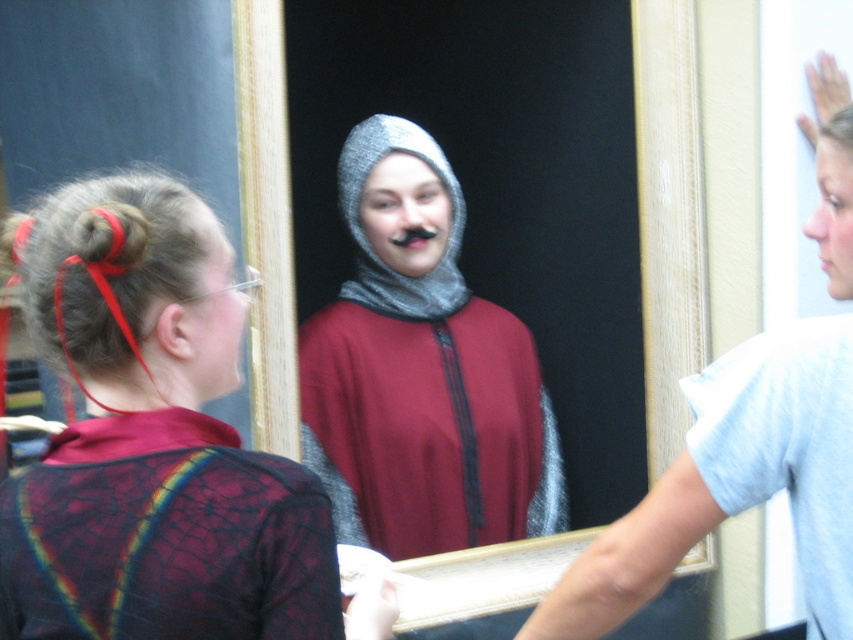
In the scene shown: Can you confirm if crinkled fabric robe at center is positioned below light blue cotton t-shirt at right?

Yes, crinkled fabric robe at center is below light blue cotton t-shirt at right.

Is crinkled fabric robe at center above light blue cotton t-shirt at right?

No, crinkled fabric robe at center is not above light blue cotton t-shirt at right.

The image size is (853, 640). Find the location of `crinkled fabric robe at center`. crinkled fabric robe at center is located at coordinates (167, 536).

You are a GUI agent. You are given a task and a screenshot of the screen. Output one action in this format:
    pyautogui.click(x=<x>, y=<y>)
    Task: Click on the crinkled fabric robe at center
    This screenshot has height=640, width=853.
    Given the screenshot: What is the action you would take?
    pyautogui.click(x=167, y=536)

Is point (73, 499) positioned after point (209, 298)?

No, it is not.

Is crinkled fabric robe at center positioned at the back of matte black hair at center?

That is False.

Find the location of a particular element. This screenshot has width=853, height=640. crinkled fabric robe at center is located at coordinates (167, 536).

Which is behind, point (146, 484) or point (845, 218)?

Point (845, 218)

Between point (16, 534) and point (840, 180), which one is positioned in front?

Point (16, 534) is in front.

The width and height of the screenshot is (853, 640). Identify the location of crinkled fabric robe at center. (167, 536).